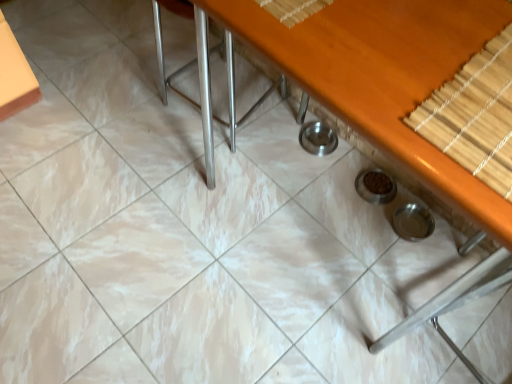
This screenshot has width=512, height=384. What are the coordinates of `free space in front of satin silver chair at center` in the screenshot? It's located at (156, 190).